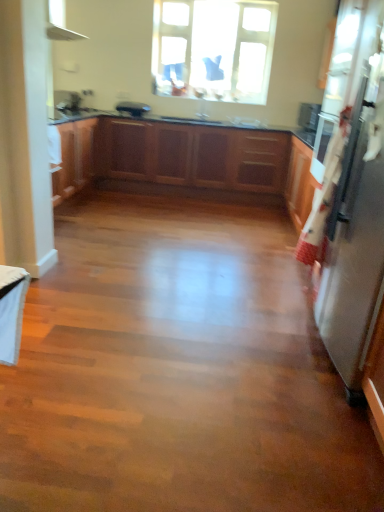
Question: Is transparent glass window at upper center next to satin silver refrigerator at right, acting as the second appliance starting from the left, and touching it?

Choices:
 (A) yes
 (B) no

Answer: (B)

Question: Can you confirm if transparent glass window at upper center is positioned to the right of satin silver refrigerator at right, arranged as the first appliance when ordered from the bottom?

Choices:
 (A) yes
 (B) no

Answer: (B)

Question: Does transparent glass window at upper center have a lesser height compared to satin silver refrigerator at right, acting as the second appliance starting from the left?

Choices:
 (A) yes
 (B) no

Answer: (A)

Question: Can you confirm if transparent glass window at upper center is smaller than satin silver refrigerator at right, arranged as the first appliance when ordered from the bottom?

Choices:
 (A) no
 (B) yes

Answer: (B)

Question: Is transparent glass window at upper center looking in the opposite direction of satin silver refrigerator at right, which ranks as the second appliance in back-to-front order?

Choices:
 (A) no
 (B) yes

Answer: (A)

Question: Would you consider transparent glass window at upper center to be distant from satin silver refrigerator at right, marked as the first appliance in a front-to-back arrangement?

Choices:
 (A) no
 (B) yes

Answer: (B)

Question: Considering the relative sizes of satin black toaster at center, positioned as the 2th appliance in front-to-back order, and wooden cabinets at center in the image provided, is satin black toaster at center, positioned as the 2th appliance in front-to-back order, shorter than wooden cabinets at center?

Choices:
 (A) no
 (B) yes

Answer: (B)

Question: Is satin black toaster at center, the first appliance positioned from the top, bigger than wooden cabinets at center?

Choices:
 (A) yes
 (B) no

Answer: (B)

Question: From the image's perspective, would you say satin black toaster at center, positioned as the 2th appliance in front-to-back order, is positioned over wooden cabinets at center?

Choices:
 (A) yes
 (B) no

Answer: (A)

Question: From a real-world perspective, is satin black toaster at center, placed as the first appliance when sorted from back to front, located beneath wooden cabinets at center?

Choices:
 (A) no
 (B) yes

Answer: (A)

Question: From the image's perspective, is satin black toaster at center, positioned as the 2th appliance in front-to-back order, under wooden cabinets at center?

Choices:
 (A) no
 (B) yes

Answer: (A)

Question: Is satin black toaster at center, the 2th appliance from the right, with wooden cabinets at center?

Choices:
 (A) yes
 (B) no

Answer: (B)

Question: Can you confirm if satin silver refrigerator at right, acting as the second appliance starting from the left, is positioned to the right of satin black toaster at center, placed as the first appliance when sorted from back to front?

Choices:
 (A) yes
 (B) no

Answer: (A)